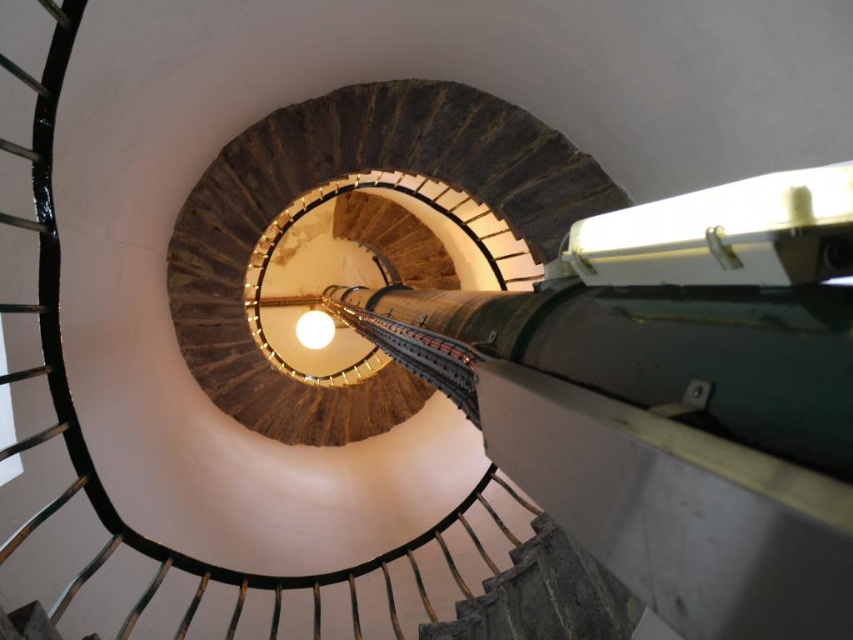
Question: Among these objects, which one is farthest from the camera?

Choices:
 (A) stone textured stairs at center
 (B) wooden stairs at center

Answer: (B)

Question: Which point is farther from the camera taking this photo?

Choices:
 (A) (306, 166)
 (B) (561, 618)

Answer: (A)

Question: From the image, what is the correct spatial relationship of wooden stairs at center in relation to stone textured stairs at center?

Choices:
 (A) left
 (B) right

Answer: (A)

Question: Can you confirm if wooden stairs at center is positioned above stone textured stairs at center?

Choices:
 (A) no
 (B) yes

Answer: (B)

Question: From the image, what is the correct spatial relationship of wooden stairs at center in relation to stone textured stairs at center?

Choices:
 (A) right
 (B) left

Answer: (B)